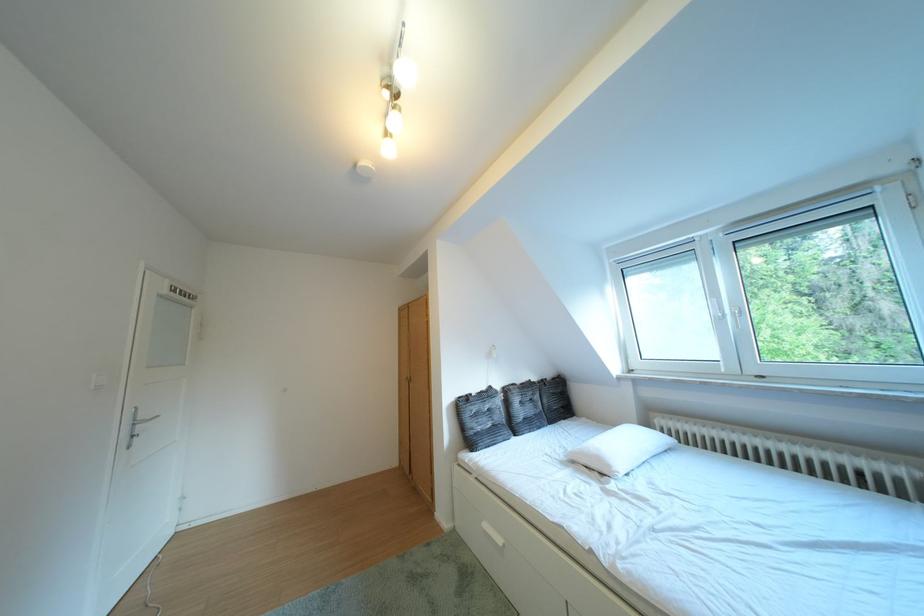
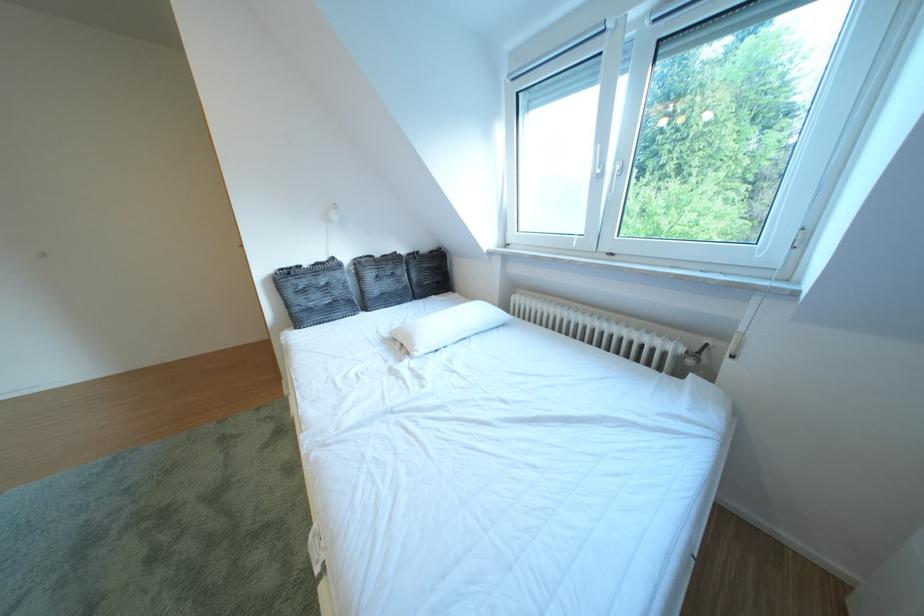
What movement of the cameraman would produce the second image?

The cameraman moved toward right, forward.